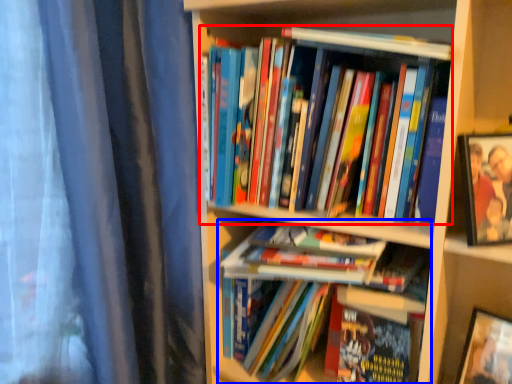
Question: Which point is further to the camera, book (highlighted by a red box) or book (highlighted by a blue box)?

Choices:
 (A) book
 (B) book

Answer: (B)